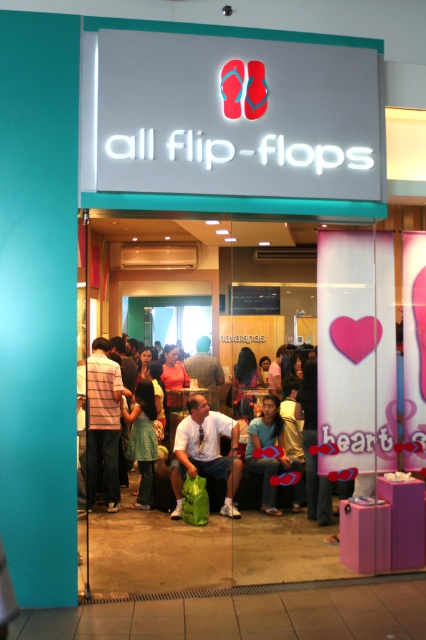
You are a customer at the retail store entrance. You see the light blue denim jeans at center and the striped shirt at center. Which item is larger in size?

The light blue denim jeans at center is bigger than the striped shirt at center.